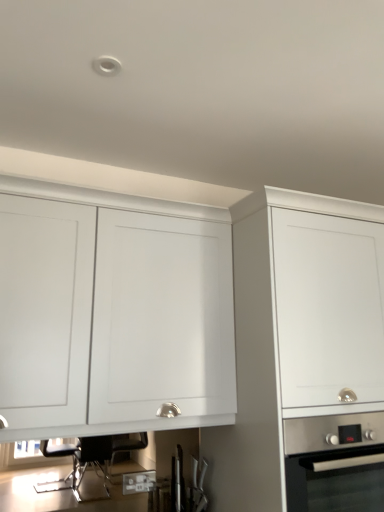
Question: Based on their positions, is white matte cabinet at upper left, which ranks as the 2th cabinetry in right-to-left order, located to the left or right of white matte cabinet at center, which ranks as the 1th cabinetry in right-to-left order?

Choices:
 (A) right
 (B) left

Answer: (B)

Question: In terms of height, does white matte cabinet at upper left, the first cabinetry viewed from the left, look taller or shorter compared to white matte cabinet at center, which ranks as the 1th cabinetry in right-to-left order?

Choices:
 (A) short
 (B) tall

Answer: (A)

Question: Which object is positioned farthest from the stainless steel oven at lower right?

Choices:
 (A) white matte cabinet at upper left, the first cabinetry viewed from the left
 (B) white matte cabinet at center, positioned as the 2th cabinetry in left-to-right order

Answer: (A)

Question: Based on their relative distances, which object is nearer to the stainless steel oven at lower right?

Choices:
 (A) white matte cabinet at center, positioned as the 2th cabinetry in left-to-right order
 (B) white matte cabinet at upper left, which ranks as the 2th cabinetry in right-to-left order

Answer: (A)